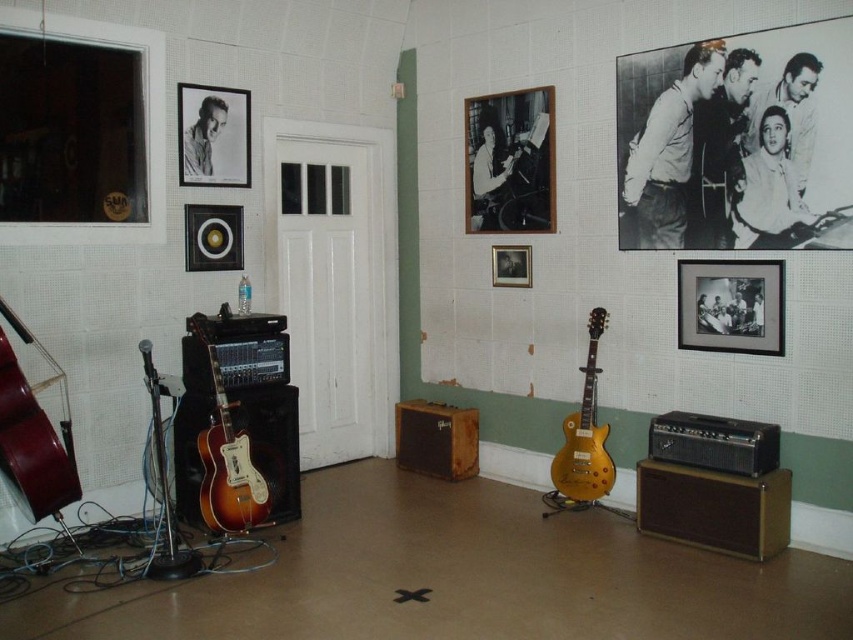
You are setting up a display in the music room and need to know which object takes up more space. Which one is larger between the black matte picture frame at center right and the sunburst wood electric guitar at center?

The sunburst wood electric guitar at center is larger than the black matte picture frame at center right, so it occupies more space.

You are a photographer setting up a tripod to take a photo of the black matte picture frame at center right and the matte plastic speaker at upper left. Which object should you focus on first to ensure both are in focus?

The black matte picture frame at center right is closer to the viewer than the matte plastic speaker at upper left, so you should focus on the black matte picture frame at center right first to ensure both are in focus.

You are setting up a display in the music room and need to arrange the mahogany wood cello at left and the black glossy picture frame at center. Which object requires more horizontal space for proper placement?

The mahogany wood cello at left requires more horizontal space because its width surpasses that of the black glossy picture frame at center.